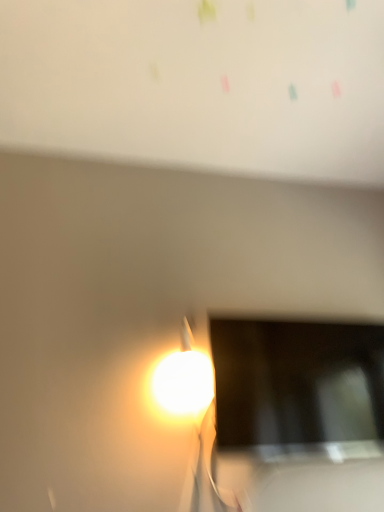
Question: From a real-world perspective, does matte black screen at lower right sit lower than white matte bulletin board at upper center?

Choices:
 (A) yes
 (B) no

Answer: (A)

Question: Does matte black screen at lower right turn towards white matte bulletin board at upper center?

Choices:
 (A) yes
 (B) no

Answer: (B)

Question: Is the depth of matte black screen at lower right less than that of white matte bulletin board at upper center?

Choices:
 (A) yes
 (B) no

Answer: (B)

Question: Is matte black screen at lower right wider than white matte bulletin board at upper center?

Choices:
 (A) yes
 (B) no

Answer: (B)

Question: Is matte black screen at lower right smaller than white matte bulletin board at upper center?

Choices:
 (A) no
 (B) yes

Answer: (B)

Question: Considering the relative sizes of matte black screen at lower right and white matte bulletin board at upper center in the image provided, is matte black screen at lower right shorter than white matte bulletin board at upper center?

Choices:
 (A) yes
 (B) no

Answer: (B)

Question: Considering the relative sizes of white matte bulletin board at upper center and matte black screen at lower right in the image provided, is white matte bulletin board at upper center bigger than matte black screen at lower right?

Choices:
 (A) yes
 (B) no

Answer: (A)

Question: From the image's perspective, would you say white matte bulletin board at upper center is shown under matte black screen at lower right?

Choices:
 (A) yes
 (B) no

Answer: (B)

Question: Is the depth of white matte bulletin board at upper center greater than that of matte black screen at lower right?

Choices:
 (A) yes
 (B) no

Answer: (B)

Question: Considering the relative positions of white matte bulletin board at upper center and matte black screen at lower right in the image provided, is white matte bulletin board at upper center to the right of matte black screen at lower right from the viewer's perspective?

Choices:
 (A) no
 (B) yes

Answer: (A)

Question: Is white matte bulletin board at upper center wider than matte black screen at lower right?

Choices:
 (A) yes
 (B) no

Answer: (A)

Question: Is white matte bulletin board at upper center far from matte black screen at lower right?

Choices:
 (A) yes
 (B) no

Answer: (B)

Question: From a real-world perspective, relative to matte black screen at lower right, is white matte bulletin board at upper center vertically above or below?

Choices:
 (A) below
 (B) above

Answer: (B)